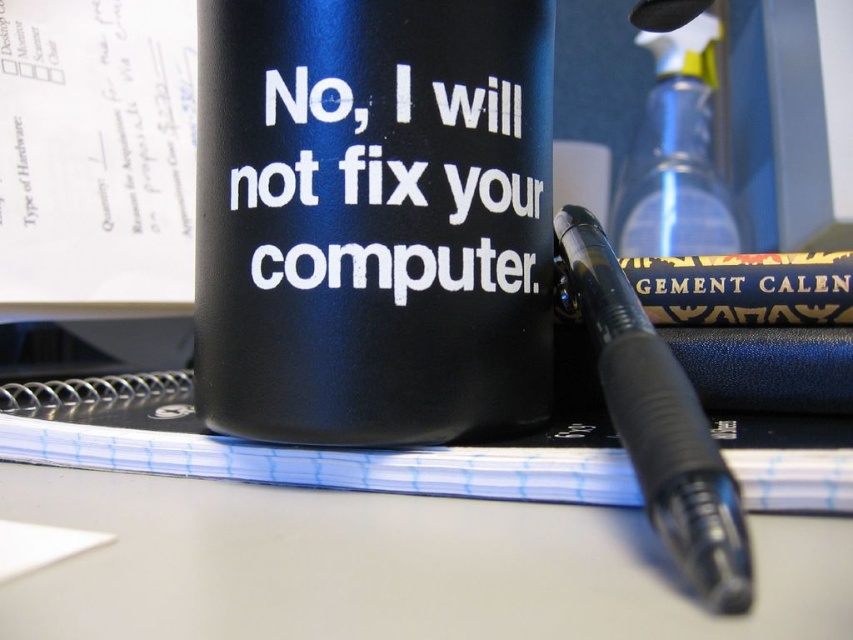
Question: Is black matte mug at center above black matte text at center?

Choices:
 (A) no
 (B) yes

Answer: (A)

Question: Can you confirm if black matte mug at center is bigger than black matte text at center?

Choices:
 (A) yes
 (B) no

Answer: (A)

Question: Which point is farther from the camera taking this photo?

Choices:
 (A) (695, 253)
 (B) (502, 19)
 (C) (233, 170)
 (D) (715, 563)

Answer: (A)

Question: Which point appears closest to the camera in this image?

Choices:
 (A) (469, 164)
 (B) (734, 248)

Answer: (A)

Question: Which point is farther to the camera?

Choices:
 (A) (544, 253)
 (B) (587, 301)
 (C) (532, 282)
 (D) (738, 236)

Answer: (D)

Question: From the image, what is the correct spatial relationship of black matte mug at center in relation to black matte text at center?

Choices:
 (A) right
 (B) left

Answer: (B)